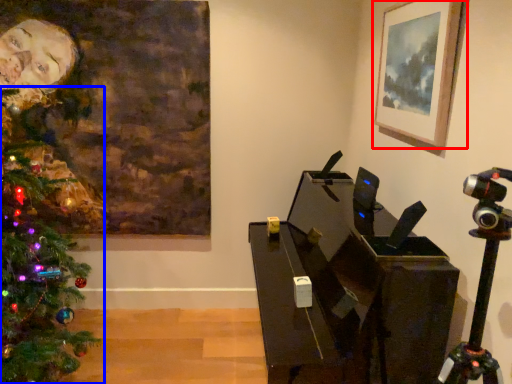
Question: Which object appears closest to the camera in this image, picture frame (highlighted by a red box) or christmas tree (highlighted by a blue box)?

Choices:
 (A) picture frame
 (B) christmas tree

Answer: (B)